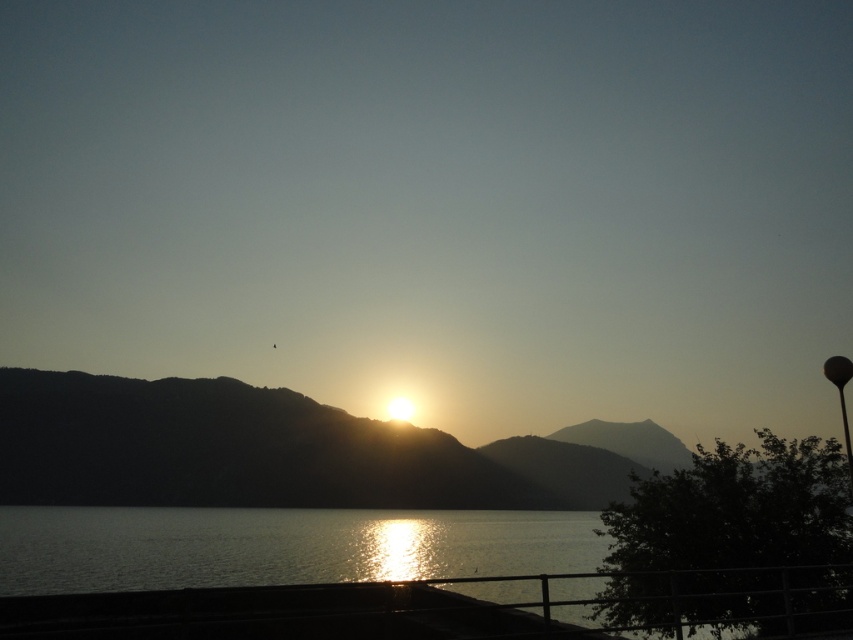
You are standing on the dock and want to know how far the point at coordinates (393, 452) is from your current position. Can you determine the distance?

The distance of point (393, 452) from camera is 845.65 feet, so the point is 845.65 feet away from your current position on the dock.

Consider the image. You are standing on a dock overlooking a lake at sunset. You notice a point marked at coordinates [265,451]. What object is located at that point?

The silvery metallic mountain at center is located at point [265,451].